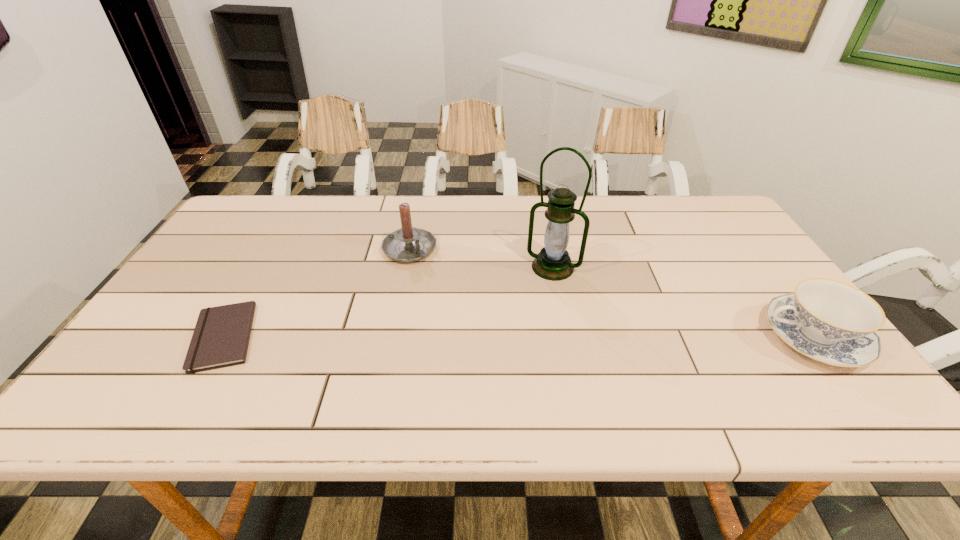
You are a GUI agent. You are given a task and a screenshot of the screen. Output one action in this format:
    pyautogui.click(x=<x>, y=<y>)
    Task: Click on the vacant point located with the handle on the side of the chinaware
    The image size is (960, 540).
    Given the screenshot: What is the action you would take?
    pyautogui.click(x=650, y=337)

You are a GUI agent. You are given a task and a screenshot of the screen. Output one action in this format:
    pyautogui.click(x=<x>, y=<y>)
    Task: Click on the free point located with the handle on the side of the chinaware
    Image resolution: width=960 pixels, height=540 pixels.
    Given the screenshot: What is the action you would take?
    pyautogui.click(x=599, y=337)

Find the location of a particular element. free spot located 0.260m on the side where the lantern emits light is located at coordinates (512, 347).

In order to click on free space located 0.280m on the side where the lantern emits light in this screenshot , I will do `click(508, 353)`.

Locate an element on the screen. vacant region located on the side where the lantern emits light is located at coordinates (528, 313).

This screenshot has width=960, height=540. I want to click on free point located on the side of the second object from left to right with the handle loop, so click(491, 311).

Where is `free space located 0.230m on the side of the second object from left to right with the handle loop`? free space located 0.230m on the side of the second object from left to right with the handle loop is located at coordinates (480, 303).

The height and width of the screenshot is (540, 960). I want to click on vacant point located 0.370m on the side of the second object from left to right with the handle loop, so click(x=519, y=333).

Where is `object located at the far edge`? This screenshot has width=960, height=540. object located at the far edge is located at coordinates (408, 244).

The image size is (960, 540). Find the location of `checkbook present at the near edge`. checkbook present at the near edge is located at coordinates (221, 336).